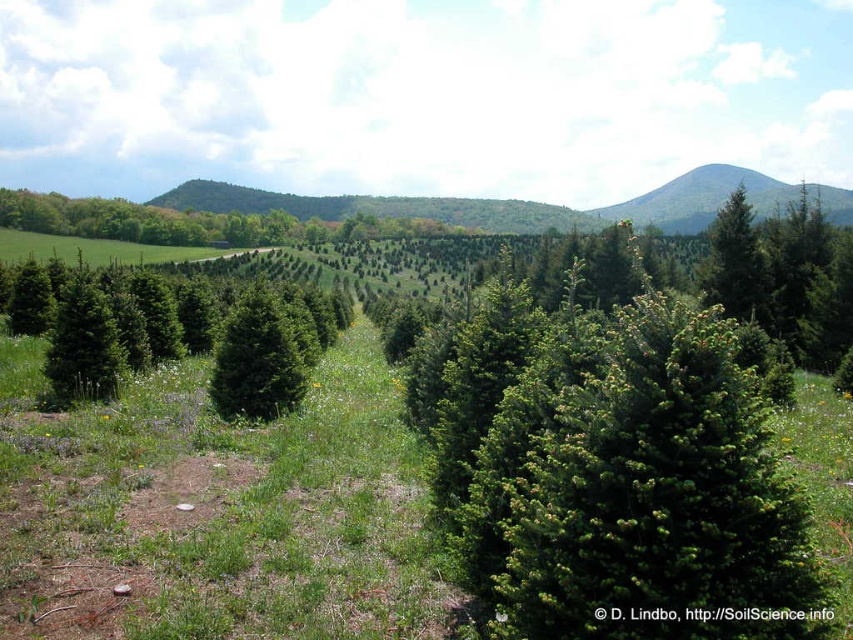
You are standing in the field of young evergreen trees and want to take a photo of the green textured hillside at upper right. To ensure the hillside is in the center of your photo, where should you position the camera relative to the hillside?

The green textured hillside at upper right is located at coordinates [720,198], so to center it in the photo, position the camera so the hillside is at the center point of the frame.

You are a landscape photographer planning to take a photo of the green matte evergreen tree at center and the green textured hillside at upper right. Which object should you focus on first if you want to capture both in a single frame with proper depth of field?

The green matte evergreen tree at center is located below the green textured hillside at upper right. To capture both in a single frame with proper depth of field, focus on the green textured hillside at upper right first since it is farther away, ensuring both foreground and background elements are in focus.

You are standing in the middle of the Christmas tree field and want to walk to the point that is closer to you. Which point should you head towards, point (57,346) or point (726,214)?

You should head towards point (57,346) because it is closer to the viewer than point (726,214).